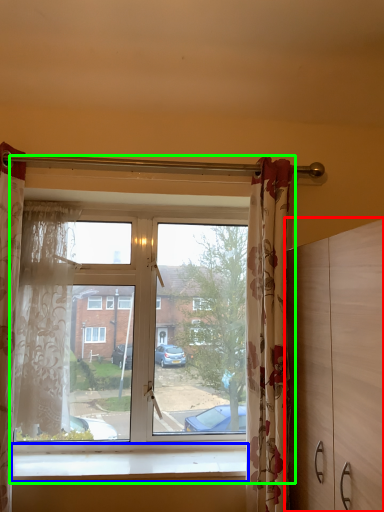
Question: Which object is positioned farthest from dresser (highlighted by a red box)? Select from window sill (highlighted by a blue box) and window (highlighted by a green box).

Choices:
 (A) window sill
 (B) window

Answer: (B)